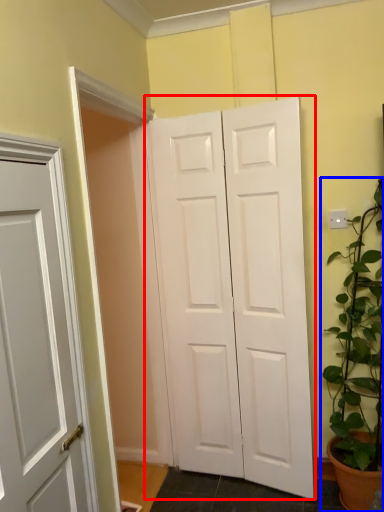
Question: Which of the following is the closest to the observer, door (highlighted by a red box) or houseplant (highlighted by a blue box)?

Choices:
 (A) door
 (B) houseplant

Answer: (B)